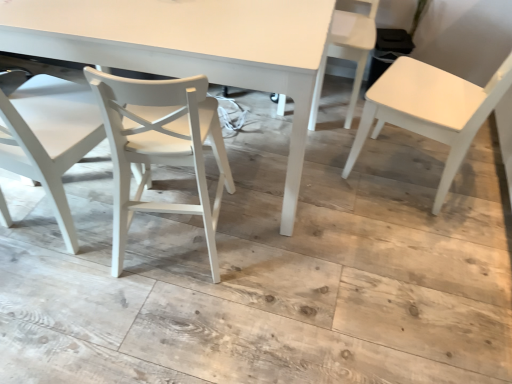
The width and height of the screenshot is (512, 384). In order to click on free space in front of white matte chair at center, acting as the 3th chair starting from the right in this screenshot , I will do `click(158, 322)`.